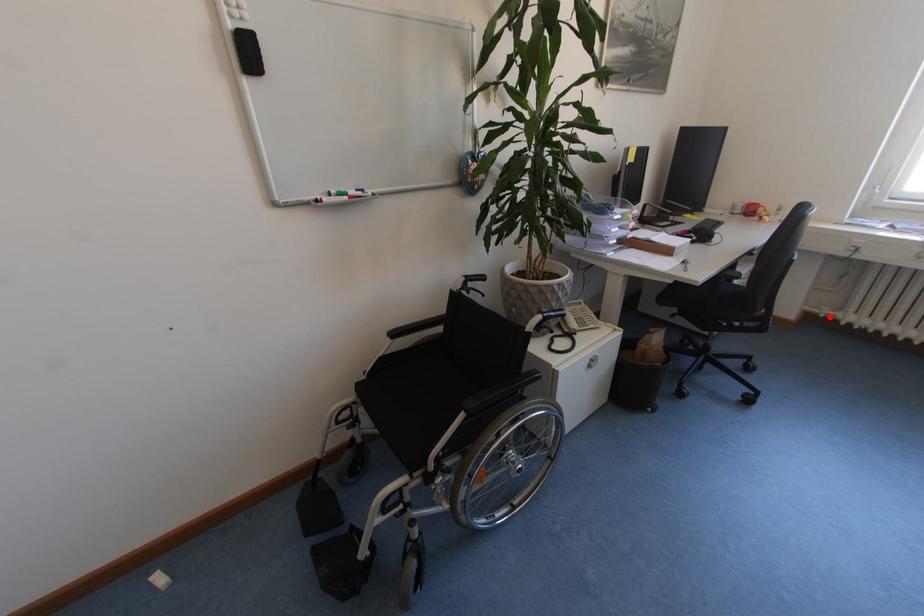
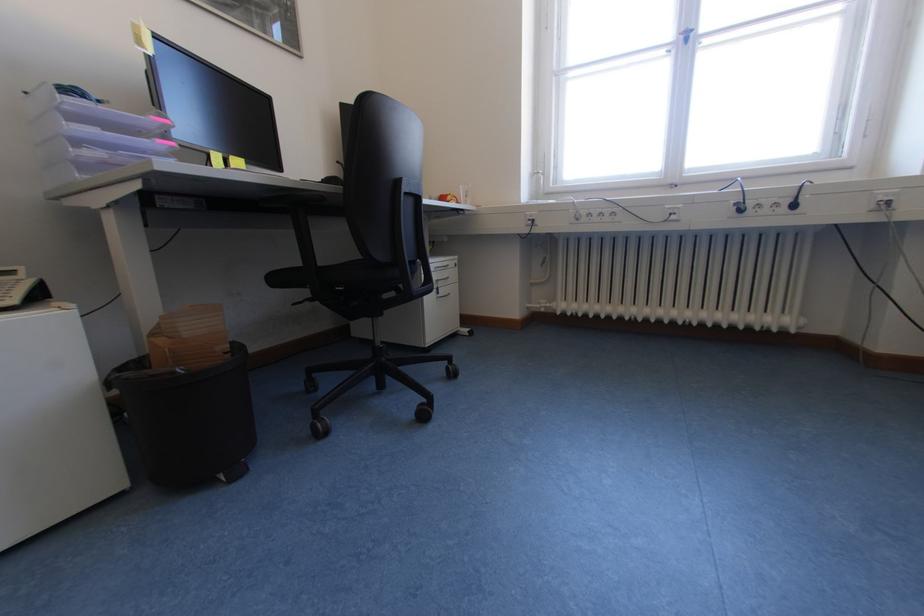
Question: I am providing you with two images of the same scene from different viewpoints. A red point is shown in image1. For the corresponding object point in image2, is it positioned nearer or farther from the camera?

Choices:
 (A) Nearer
 (B) Farther

Answer: (A)